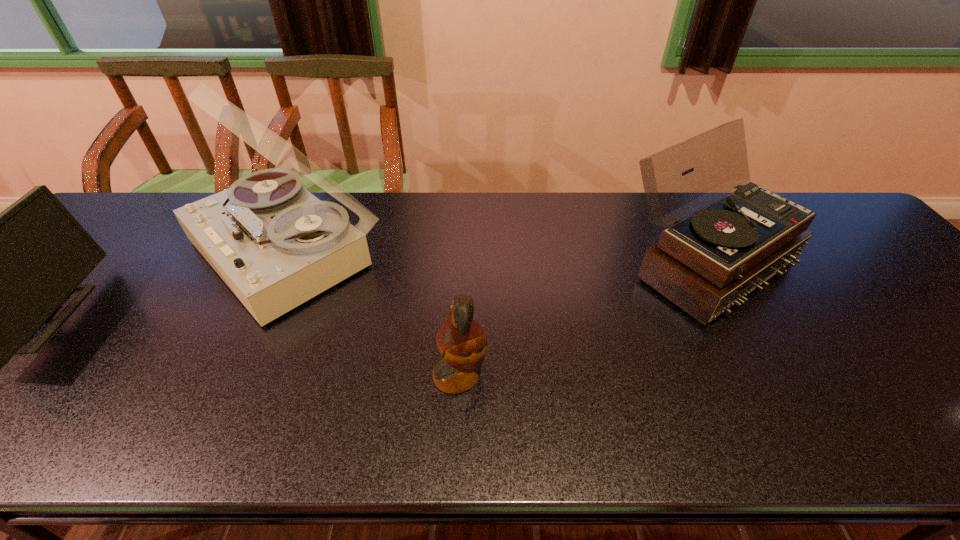
The width and height of the screenshot is (960, 540). What are the coordinates of `free spot at the left edge of the desktop` in the screenshot? It's located at (26, 372).

Where is `free space at the right edge`? The image size is (960, 540). free space at the right edge is located at coordinates (953, 335).

In the image, there is a desktop. Identify the location of free space at the far left corner. The height and width of the screenshot is (540, 960). (152, 211).

In the image, there is a desktop. Find the location of `vacant area at the far right corner`. vacant area at the far right corner is located at coordinates (826, 195).

In order to click on free point between the second object from right to left and the tallest object in this screenshot , I will do `click(373, 313)`.

This screenshot has height=540, width=960. I want to click on free spot between the parrot and the tallest object, so click(373, 313).

Locate an element on the screen. the closest object to the tallest object is located at coordinates (0, 276).

Choose which object is the second nearest neighbor to the third object from right to left. Please provide its 2D coordinates. Your answer should be formatted as a tuple, i.e. [(x, y)], where the tuple contains the x and y coordinates of a point satisfying the conditions above.

[(462, 343)]